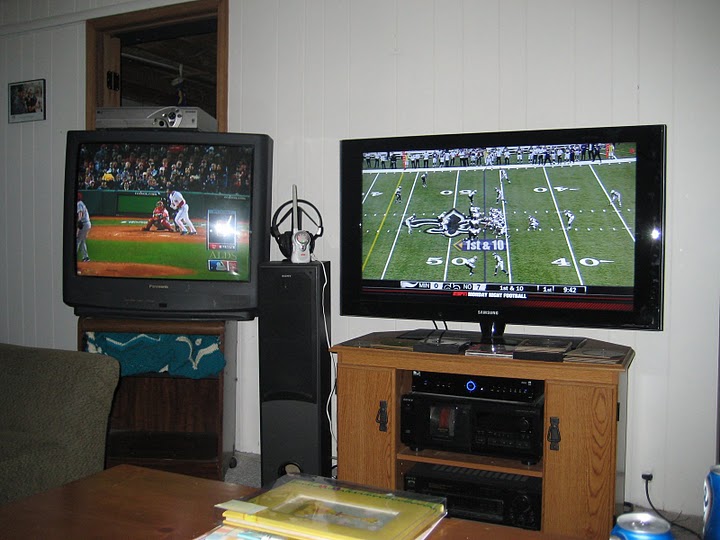
Find the location of a particular element. Image resolution: width=720 pixels, height=540 pixels. chair is located at coordinates (45, 437).